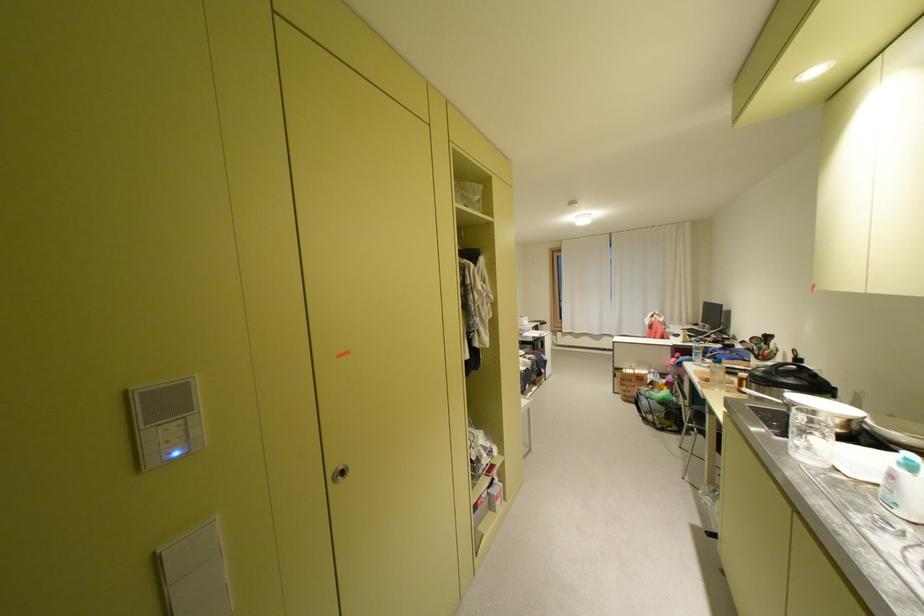
Find where to insert the silver keyhole. Please return your answer as a coordinate pair (x, y).

(339, 474)